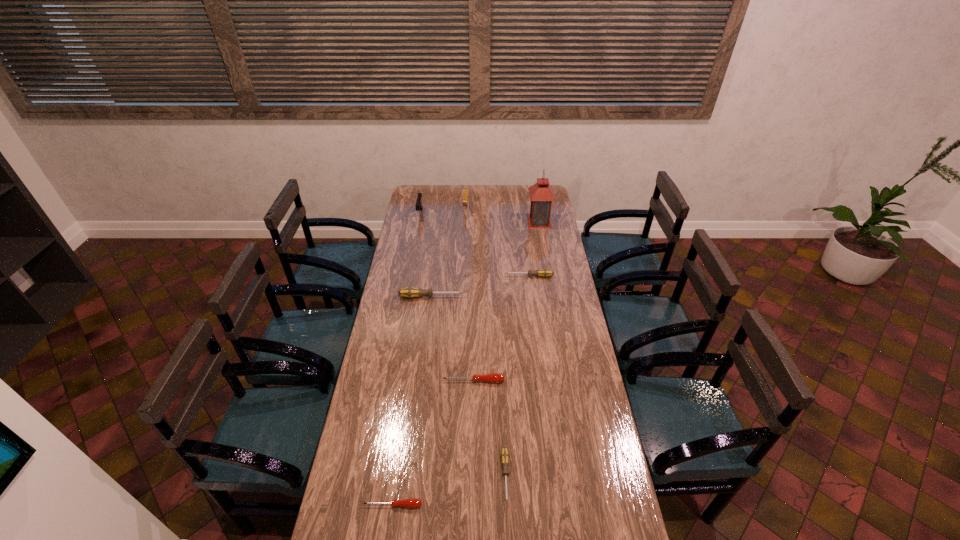
The image size is (960, 540). What are the coordinates of `blank space at the right edge of the desktop` in the screenshot? It's located at (622, 512).

Locate an element on the screen. The image size is (960, 540). vacant space at the far left corner is located at coordinates (408, 204).

At what (x,y) coordinates should I click in order to perform the action: click on unoccupied position between the right red screwdriver and the fifth shortest object. Please return your answer as a coordinate pair (x, y). The width and height of the screenshot is (960, 540). Looking at the image, I should click on (452, 339).

Where is `unoccupied position between the fourth tallest object and the left pistol`? Image resolution: width=960 pixels, height=540 pixels. unoccupied position between the fourth tallest object and the left pistol is located at coordinates (425, 255).

At what (x,y) coordinates should I click in order to perform the action: click on free space between the nearest gray screwdriver and the left pistol. Please return your answer as a coordinate pair (x, y). The image size is (960, 540). Looking at the image, I should click on (463, 345).

At what (x,y) coordinates should I click in order to perform the action: click on free spot between the shortest screwdriver and the second farthest gray screwdriver. Please return your answer as a coordinate pair (x, y). Looking at the image, I should click on (412, 401).

At what (x,y) coordinates should I click in order to perform the action: click on free area in between the right pistol and the tallest object. Please return your answer as a coordinate pair (x, y). This screenshot has height=540, width=960. Looking at the image, I should click on (502, 216).

Locate an element on the screen. The height and width of the screenshot is (540, 960). blank region between the farther red screwdriver and the tan pistol is located at coordinates (469, 295).

At what (x,y) coordinates should I click in order to perform the action: click on free space between the tan pistol and the third nearest screwdriver. Please return your answer as a coordinate pair (x, y). This screenshot has width=960, height=540. Looking at the image, I should click on [x=469, y=295].

Identify the location of vacant space in between the biggest gray screwdriver and the nearer red screwdriver. (412, 401).